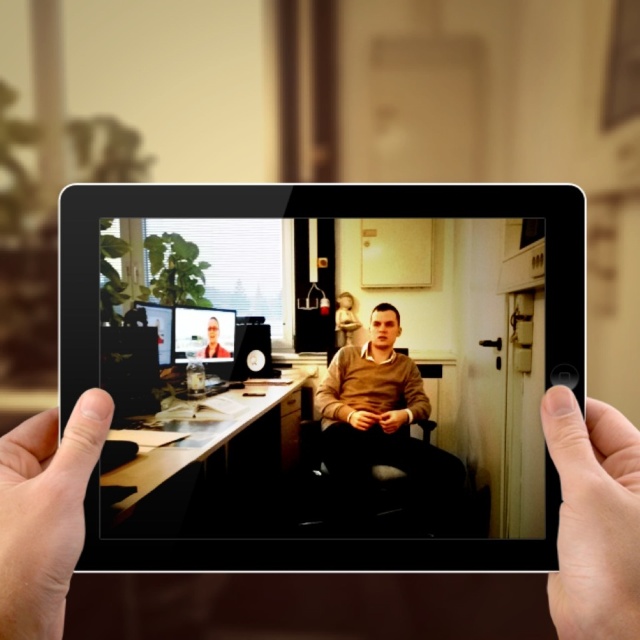
This screenshot has height=640, width=640. What do you see at coordinates (381, 426) in the screenshot?
I see `brown sweater at center` at bounding box center [381, 426].

Does brown sweater at center have a larger size compared to matte plastic computer screen at center?

Indeed, brown sweater at center has a larger size compared to matte plastic computer screen at center.

I want to click on brown sweater at center, so click(381, 426).

Find the location of a particular element. The width and height of the screenshot is (640, 640). brown sweater at center is located at coordinates (381, 426).

Does smooth skin at lower left come in front of brown sweater at center?

Yes.

From the picture: Can you confirm if smooth skin at lower left is positioned to the left of brown sweater at center?

Indeed, smooth skin at lower left is positioned on the left side of brown sweater at center.

Who is more distant from viewer, (x=58, y=448) or (x=353, y=426)?

The point (x=353, y=426) is more distant.

Find the location of a particular element. The height and width of the screenshot is (640, 640). smooth skin at lower left is located at coordinates (44, 513).

Between smooth skin hand at right and brown sweater at center, which one appears on the right side from the viewer's perspective?

From the viewer's perspective, smooth skin hand at right appears more on the right side.

Between point (547, 444) and point (352, 404), which one is positioned in front?

Point (547, 444) is more forward.

Is point (588, 625) more distant than point (460, 497)?

No, it is in front of (460, 497).

At what (x,y) coordinates should I click in order to perform the action: click on smooth skin hand at right. Please return your answer as a coordinate pair (x, y). The image size is (640, 640). Looking at the image, I should click on (593, 518).